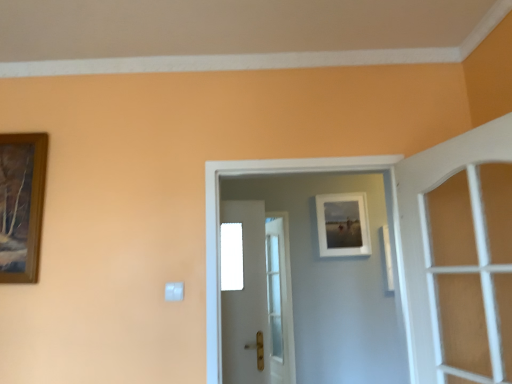
The height and width of the screenshot is (384, 512). What are the coordinates of `white wooden door at right, the first door positioned from the front` in the screenshot? It's located at (426, 229).

The width and height of the screenshot is (512, 384). In order to click on matte white picture frame at upper center in this screenshot , I will do `click(343, 225)`.

Is white glossy door at center, the second door in the back-to-front sequence, inside white wooden door at right, the first door positioned from the front?

That's incorrect, white glossy door at center, the second door in the back-to-front sequence, is not inside white wooden door at right, the first door positioned from the front.

Considering the relative positions of white wooden door at right, which appears as the 3th door when viewed from the back, and white glossy door at center, the second door in the back-to-front sequence, in the image provided, is white wooden door at right, which appears as the 3th door when viewed from the back, to the left of white glossy door at center, the second door in the back-to-front sequence, from the viewer's perspective?

Incorrect, white wooden door at right, which appears as the 3th door when viewed from the back, is not on the left side of white glossy door at center, the second door in the back-to-front sequence.

Is white wooden door at right, which appears as the 3th door when viewed from the back, positioned before white glossy door at center, which appears as the second door when viewed from the front?

Yes, it is in front of white glossy door at center, which appears as the second door when viewed from the front.

Which door is the 1st one when counting from the left side of the white wooden door at right, which appears as the 3th door when viewed from the back? Please provide its 2D coordinates.

[(219, 224)]

Considering the sizes of objects white wooden door at right, the first door positioned from the front, and white glossy door at center, the 1th door in the back-to-front sequence, in the image provided, who is taller, white wooden door at right, the first door positioned from the front, or white glossy door at center, the 1th door in the back-to-front sequence,?

white glossy door at center, the 1th door in the back-to-front sequence, is taller.

Is white wooden door at right, which appears as the 3th door when viewed from the back, oriented towards white glossy door at center, which is the 3th door from front to back?

No, white wooden door at right, which appears as the 3th door when viewed from the back, is not turned towards white glossy door at center, which is the 3th door from front to back.

Would you say white glossy door at center, the 1th door in the back-to-front sequence, is part of white wooden door at right, the first door positioned from the front,'s contents?

Definitely not — white glossy door at center, the 1th door in the back-to-front sequence, is not inside white wooden door at right, the first door positioned from the front.

Is white wooden door at right, which appears as the 3th door when viewed from the back, in front of or behind white glossy door at center, which is the 3th door from front to back, in the image?

white wooden door at right, which appears as the 3th door when viewed from the back, is in front of white glossy door at center, which is the 3th door from front to back.

Who is bigger, matte white picture frame at upper center or white plastic light switch at lower left?

Bigger between the two is matte white picture frame at upper center.

Between matte white picture frame at upper center and white plastic light switch at lower left, which one has larger width?

matte white picture frame at upper center.

Between point (358, 234) and point (176, 298), which one is positioned in front?

Point (176, 298)

Between white plastic light switch at lower left and white glossy door at center, which appears as the second door when viewed from the front, which one is positioned behind?

white plastic light switch at lower left is behind.

How different are the orientations of white plastic light switch at lower left and white glossy door at center, which appears as the second door when viewed from the front, in degrees?

The angle between the facing direction of white plastic light switch at lower left and the facing direction of white glossy door at center, which appears as the second door when viewed from the front, is 1.85 degrees.

From the image's perspective, is white plastic light switch at lower left located above or below white glossy door at center, which appears as the second door when viewed from the front?

From the image's perspective, white plastic light switch at lower left appears below white glossy door at center, which appears as the second door when viewed from the front.

Who is bigger, white plastic light switch at lower left or white glossy door at center, which appears as the second door when viewed from the front?

white glossy door at center, which appears as the second door when viewed from the front.

Looking at this image, is white wooden door at right, which appears as the 3th door when viewed from the back, not close to white plastic light switch at lower left?

Absolutely, white wooden door at right, which appears as the 3th door when viewed from the back, is distant from white plastic light switch at lower left.

From the image's perspective, is white wooden door at right, the first door positioned from the front, located above white plastic light switch at lower left?

Yes, from the image's perspective, white wooden door at right, the first door positioned from the front, is on top of white plastic light switch at lower left.

From a real-world perspective, between white wooden door at right, which appears as the 3th door when viewed from the back, and white plastic light switch at lower left, who is vertically higher?

white wooden door at right, which appears as the 3th door when viewed from the back, is physically above.

Considering the sizes of objects white wooden door at right, the first door positioned from the front, and white plastic light switch at lower left in the image provided, who is thinner, white wooden door at right, the first door positioned from the front, or white plastic light switch at lower left?

With smaller width is white plastic light switch at lower left.

Between white plastic light switch at lower left and white glossy door at center, the 1th door in the back-to-front sequence, which one has larger size?

Bigger between the two is white glossy door at center, the 1th door in the back-to-front sequence.

You are a GUI agent. You are given a task and a screenshot of the screen. Output one action in this format:
    pyautogui.click(x=<x>, y=<y>)
    Task: Click on the light switch lying above the white glossy door at center, which is the 3th door from front to back (from the image's perspective)
    This screenshot has width=512, height=384.
    Given the screenshot: What is the action you would take?
    pyautogui.click(x=174, y=291)

Does white plastic light switch at lower left turn towards white glossy door at center, which is the 3th door from front to back?

No, white plastic light switch at lower left is not oriented towards white glossy door at center, which is the 3th door from front to back.

Does white glossy door at center, the 1th door in the back-to-front sequence, have a lesser height compared to white plastic light switch at lower left?

Incorrect, the height of white glossy door at center, the 1th door in the back-to-front sequence, does not fall short of that of white plastic light switch at lower left.

Is white glossy door at center, which is the 3th door from front to back, spatially inside white plastic light switch at lower left, or outside of it?

white glossy door at center, which is the 3th door from front to back, exists outside the volume of white plastic light switch at lower left.

Which of these two, white glossy door at center, which is the 3th door from front to back, or white plastic light switch at lower left, is bigger?

Bigger between the two is white glossy door at center, which is the 3th door from front to back.

Locate an element on the screen. the 1st door below the white wooden door at right, which appears as the 3th door when viewed from the back (from the image's perspective) is located at coordinates (219, 224).

From a real-world perspective, starting from the white glossy door at center, the 1th door in the back-to-front sequence, which door is the 2nd one vertically above it? Please provide its 2D coordinates.

[(426, 229)]

Estimate the real-world distances between objects in this image. Which object is further from white plastic light switch at lower left, matte white picture frame at upper center or white glossy door at center, the second door in the back-to-front sequence?

matte white picture frame at upper center is positioned further to the anchor white plastic light switch at lower left.

From the image, which object appears to be nearer to white plastic light switch at lower left, white glossy door at center, which appears as the second door when viewed from the front, or white glossy door at center, the 1th door in the back-to-front sequence?

Among the two, white glossy door at center, which appears as the second door when viewed from the front, is located nearer to white plastic light switch at lower left.

When comparing their distances from white wooden door at right, which appears as the 3th door when viewed from the back, does matte white picture frame at upper center or white glossy door at center, which is the 3th door from front to back, seem further?

Based on the image, white glossy door at center, which is the 3th door from front to back, appears to be further to white wooden door at right, which appears as the 3th door when viewed from the back.

Which object lies nearer to the anchor point white glossy door at center, which is the 3th door from front to back, matte white picture frame at upper center or white wooden door at right, the first door positioned from the front?

Based on the image, matte white picture frame at upper center appears to be nearer to white glossy door at center, which is the 3th door from front to back.

Looking at the image, which one is located further to white glossy door at center, which appears as the second door when viewed from the front, white wooden door at right, the first door positioned from the front, or matte white picture frame at upper center?

Based on the image, matte white picture frame at upper center appears to be further to white glossy door at center, which appears as the second door when viewed from the front.

Which object lies nearer to the anchor point white plastic light switch at lower left, white glossy door at center, which is the 3th door from front to back, or white glossy door at center, which appears as the second door when viewed from the front?

Based on the image, white glossy door at center, which appears as the second door when viewed from the front, appears to be nearer to white plastic light switch at lower left.

Considering their positions, is white wooden door at right, the first door positioned from the front, positioned further to matte white picture frame at upper center than white plastic light switch at lower left?

white plastic light switch at lower left.

Which object lies nearer to the anchor point white glossy door at center, the second door in the back-to-front sequence, white wooden door at right, which appears as the 3th door when viewed from the back, or white plastic light switch at lower left?

Among the two, white wooden door at right, which appears as the 3th door when viewed from the back, is located nearer to white glossy door at center, the second door in the back-to-front sequence.

Where is `light switch between white wooden door at right, which appears as the 3th door when viewed from the back, and white glossy door at center, which is the 3th door from front to back, from front to back`? light switch between white wooden door at right, which appears as the 3th door when viewed from the back, and white glossy door at center, which is the 3th door from front to back, from front to back is located at coordinates (174, 291).

You are a GUI agent. You are given a task and a screenshot of the screen. Output one action in this format:
    pyautogui.click(x=<x>, y=<y>)
    Task: Click on the light switch located between white glossy door at center, the second door in the back-to-front sequence, and white glossy door at center, which is the 3th door from front to back, in the depth direction
    The image size is (512, 384).
    Given the screenshot: What is the action you would take?
    point(174,291)

At what (x,y) coordinates should I click in order to perform the action: click on light switch between white wooden door at right, the first door positioned from the front, and matte white picture frame at upper center from front to back. Please return your answer as a coordinate pair (x, y). The height and width of the screenshot is (384, 512). Looking at the image, I should click on (174, 291).

You are a GUI agent. You are given a task and a screenshot of the screen. Output one action in this format:
    pyautogui.click(x=<x>, y=<y>)
    Task: Click on the door between white wooden door at right, which appears as the 3th door when viewed from the back, and white glossy door at center, the 1th door in the back-to-front sequence, from front to back
    The height and width of the screenshot is (384, 512).
    Given the screenshot: What is the action you would take?
    pyautogui.click(x=219, y=224)